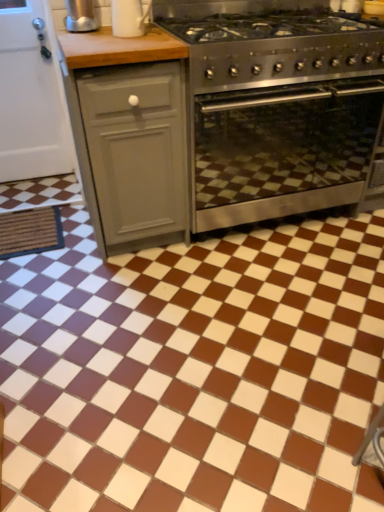
At what (x,y) coordinates should I click in order to perform the action: click on empty space that is ontop of brown glossy tile at center (from a real-world perspective). Please return your answer as a coordinate pair (x, y). This screenshot has width=384, height=512. Looking at the image, I should click on (233, 326).